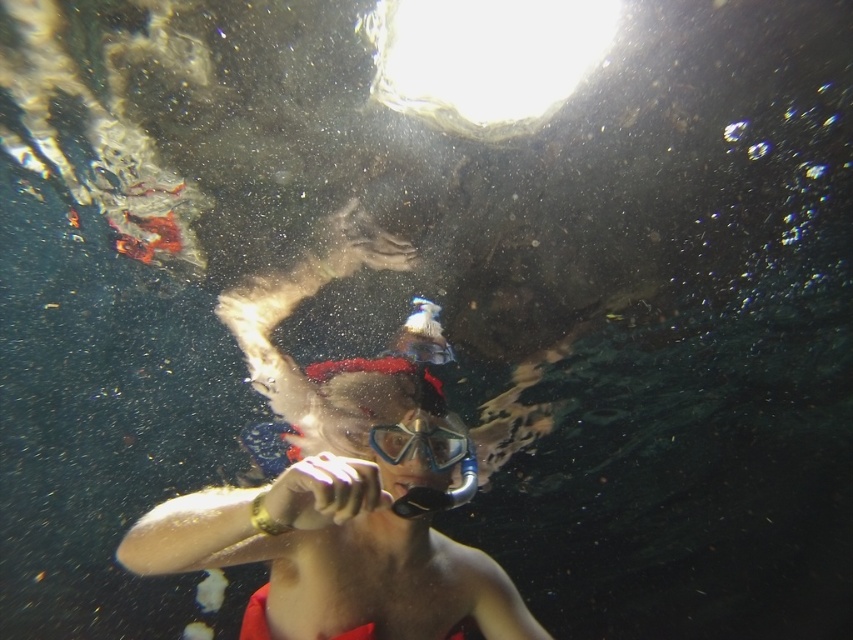
In the scene shown: You are a snorkeler who wants to take a photo of the transparent rubber goggles at center without getting the transparent water at top in the frame. Is it possible to do so given their sizes?

The transparent water at top is larger in size than the transparent rubber goggles at center, so it might be challenging to exclude the transparent water at top from the photo since it occupies more space in the frame.

You are a diver trying to locate the transparent water at top. Based on the coordinates provided, can you determine its position relative to the center of the image?

The transparent water at top is located at coordinates point (486, 58), which is slightly to the left and above the center of the image.

You are a snorkeler who wants to take a photo of the transparent rubber goggles at center. You have a camera in your right hand. To take the photo, you need to position your camera so it faces the goggles. Given the scene, where should you aim your camera relative to the transparent water at top?

You should aim your camera to the left of the transparent water at top because the transparent rubber goggles at center are located to the left of the transparent water at top.